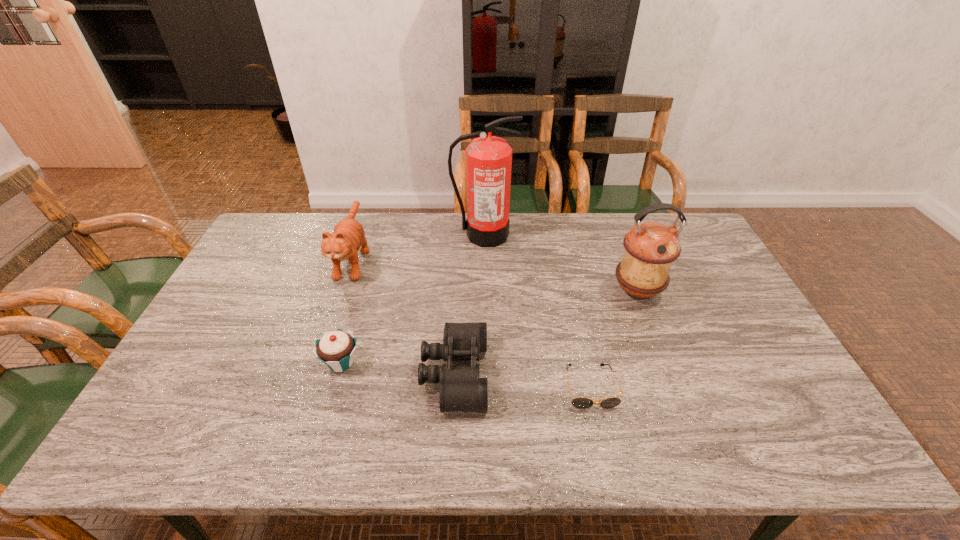
Identify the location of vacant space in between the cupcake and the fire extinguisher. [412, 299].

The height and width of the screenshot is (540, 960). In order to click on free spot between the cupcake and the binoculars in this screenshot , I will do `click(397, 368)`.

Identify the location of vacant point located between the oil lamp and the second object from right to left. The height and width of the screenshot is (540, 960). coord(613,339).

Locate an element on the screen. This screenshot has width=960, height=540. free space between the third tallest object and the oil lamp is located at coordinates (495, 274).

Identify the location of vacant point located between the cat and the sunglasses. (471, 322).

The width and height of the screenshot is (960, 540). What are the coordinates of `blank region between the binoculars and the cat` in the screenshot? It's located at (404, 316).

Identify the location of unoccupied position between the fire extinguisher and the cupcake. Image resolution: width=960 pixels, height=540 pixels. (412, 299).

Where is `free space between the fire extinguisher and the cupcake`? This screenshot has height=540, width=960. free space between the fire extinguisher and the cupcake is located at coordinates (412, 299).

The height and width of the screenshot is (540, 960). Find the location of `vacant space in between the tallest object and the third tallest object`. vacant space in between the tallest object and the third tallest object is located at coordinates (419, 246).

Image resolution: width=960 pixels, height=540 pixels. What are the coordinates of `object identified as the closest to the binoculars` in the screenshot? It's located at (336, 348).